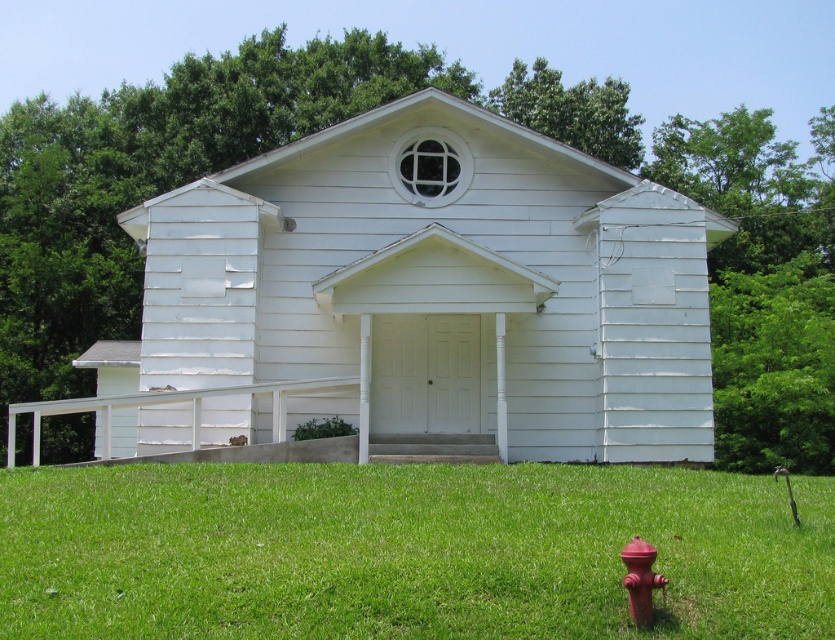
You are standing at the edge of the green grass at lower center and want to walk to the white wood church at center. Which direction should you head towards?

Since the white wood church at center is to the left of green grass at lower center, you should head towards the left direction to reach it.

From the picture: You are a painter who needs to decide whether to set up your easel closer to the white wood church at center or the red matte fire hydrant at lower right. Since you want to capture the full height of the taller object in your painting, which one should you position your easel closer to?

The white wood church at center is much taller than the red matte fire hydrant at lower right, so you should position your easel closer to the white wood church at center to capture its full height.

You are standing at the center of the grassy lawn in front of the white wood church at center. You want to walk directly towards the red fire hydrant in the lower right corner. Will you pass through the point at point coordinates [421,292]?

The white wood church at center is located at point [421,292]. Since you are starting at the center of the grassy lawn in front of the church and walking towards the red fire hydrant in the lower right corner, your path would take you away from the church. Therefore, you will not pass through the point [421,292].